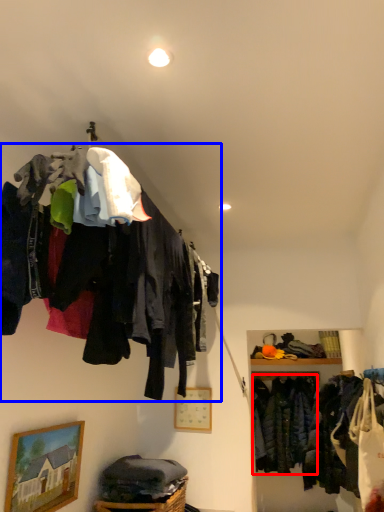
Question: Among these objects, which one is farthest to the camera, clothing (highlighted by a red box) or closet (highlighted by a blue box)?

Choices:
 (A) clothing
 (B) closet

Answer: (A)